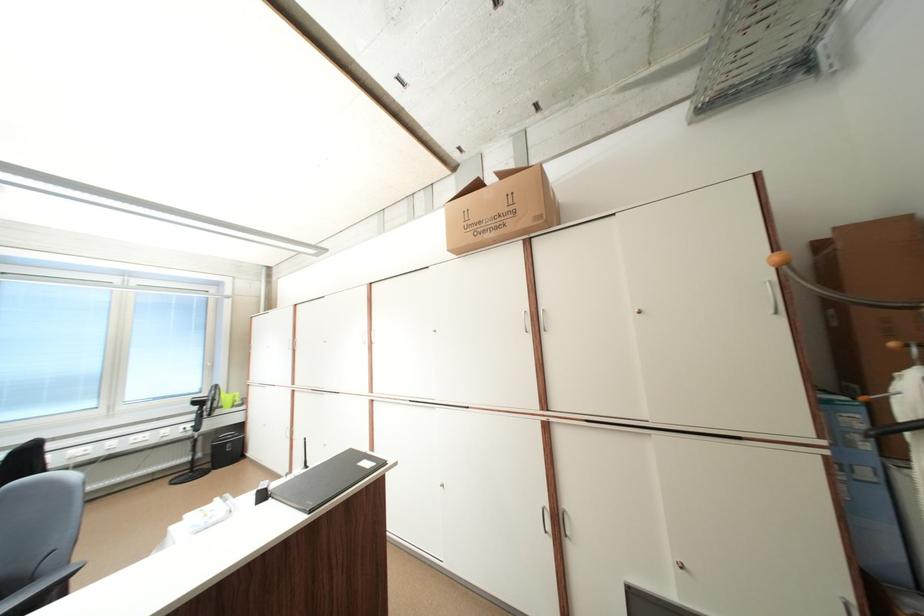
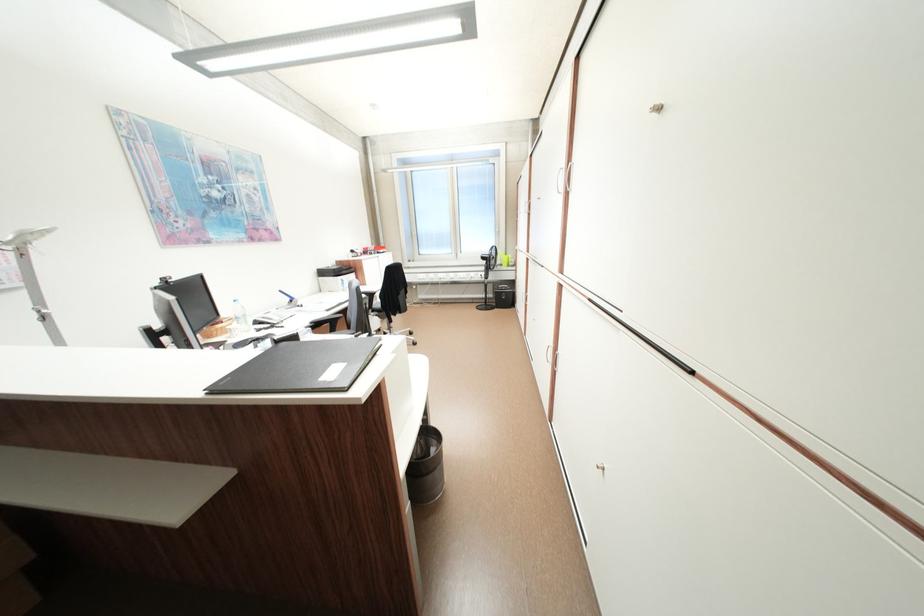
Locate, in the second image, the point that corresponds to point (204, 403) in the first image.

(492, 259)